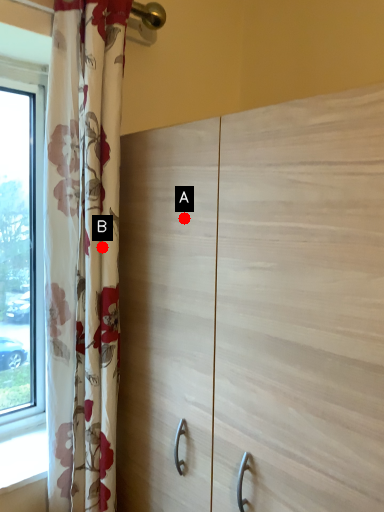
Question: Two points are circled on the image, labeled by A and B beside each circle. Which of the following is the farthest from the observer?

Choices:
 (A) A is further
 (B) B is further

Answer: (B)